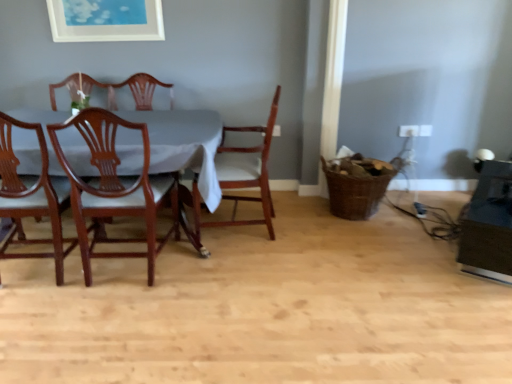
Question: Looking at the image, does mahogany wood chair at center, marked as the second chair in a right-to-left arrangement, seem bigger or smaller compared to wooden chair at center, which ranks as the first chair in right-to-left order?

Choices:
 (A) big
 (B) small

Answer: (B)

Question: In terms of height, does mahogany wood chair at center, marked as the second chair in a right-to-left arrangement, look taller or shorter compared to wooden chair at center, which is the 3th chair from left to right?

Choices:
 (A) tall
 (B) short

Answer: (A)

Question: Which object is the farthest from the brown woven basket at lower right?

Choices:
 (A) mahogany wood chair at left, placed as the first chair when sorted from left to right
 (B) wooden chair at center, which is the 3th chair from left to right
 (C) white fabric table at left
 (D) mahogany wood chair at center, which ranks as the 2th chair in left-to-right order
 (E) white matte picture frame at upper center

Answer: (A)

Question: Which of these objects is positioned closest to the mahogany wood chair at left, which ranks as the third chair in right-to-left order?

Choices:
 (A) mahogany wood chair at center, which ranks as the 2th chair in left-to-right order
 (B) white matte picture frame at upper center
 (C) white fabric table at left
 (D) brown woven basket at lower right
 (E) wooden chair at center, which ranks as the first chair in right-to-left order

Answer: (A)